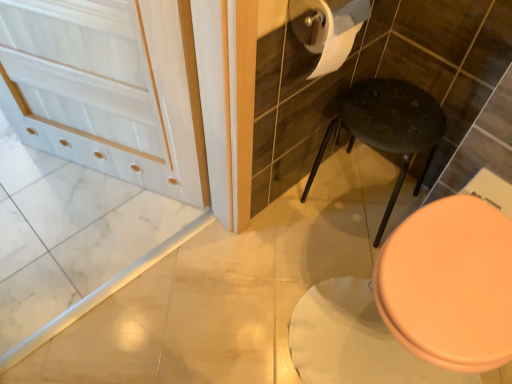
This screenshot has height=384, width=512. I want to click on vacant area on top of pink glossy toilet seat at lower right (from a real-world perspective), so click(458, 271).